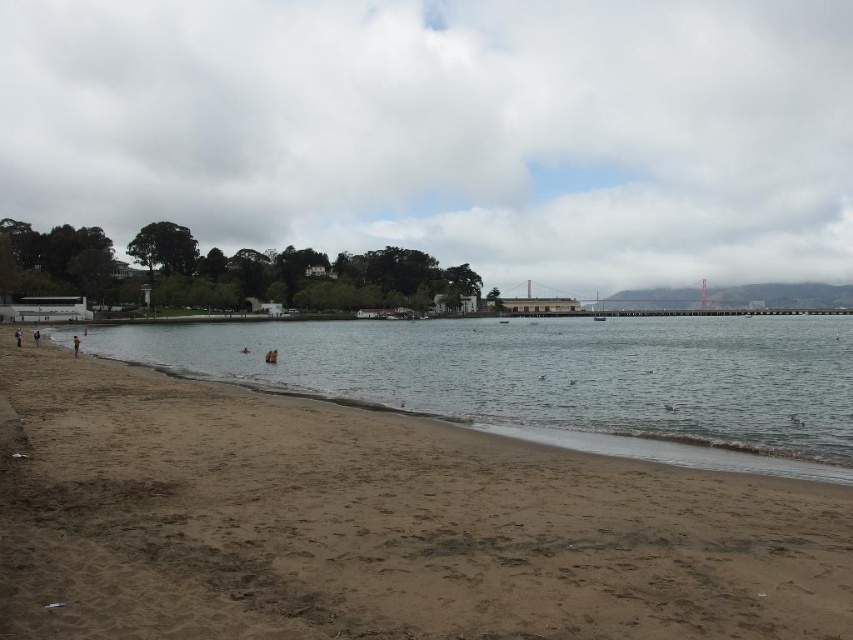
Between brown sand at lower left and clear water at beach left, which one appears on the right side from the viewer's perspective?

clear water at beach left is more to the right.

Who is more distant from viewer, (x=393, y=536) or (x=689, y=432)?

The point (x=689, y=432) is behind.

Where is `brown sand at lower left`? The image size is (853, 640). brown sand at lower left is located at coordinates (375, 524).

What are the coordinates of `cloudy sky at upper center` in the screenshot? It's located at click(x=447, y=131).

Does cloudy sky at upper center have a greater width compared to brown sand at lower left?

Correct, the width of cloudy sky at upper center exceeds that of brown sand at lower left.

Is point (207, 141) positioned in front of point (550, 518)?

No.

This screenshot has height=640, width=853. Find the location of `cloudy sky at upper center`. cloudy sky at upper center is located at coordinates (447, 131).

Is point (363, 72) positioned before point (476, 412)?

No, (363, 72) is behind (476, 412).

Is cloudy sky at upper center to the right of clear water at beach left from the viewer's perspective?

Indeed, cloudy sky at upper center is positioned on the right side of clear water at beach left.

Who is more distant from viewer, (527, 129) or (631, 385)?

The point (527, 129) is behind.

This screenshot has width=853, height=640. What are the coordinates of `cloudy sky at upper center` in the screenshot? It's located at [x=447, y=131].